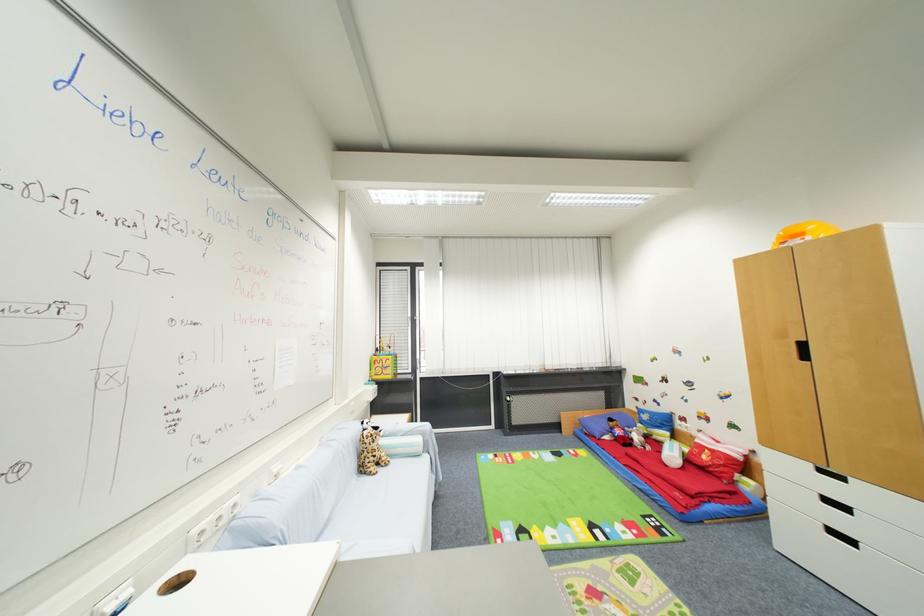
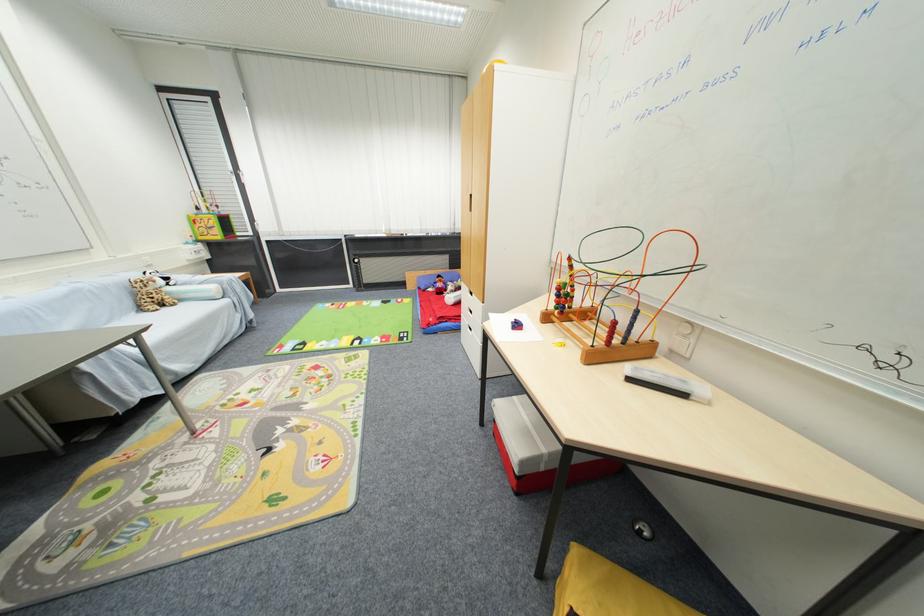
Where in the second image is the point corresponding to (x=393, y=377) from the first image?

(223, 238)